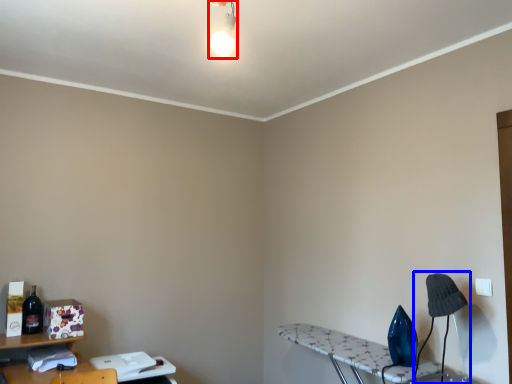
Question: Among these objects, which one is nearest to the camera, light fixture (highlighted by a red box) or table lamp (highlighted by a blue box)?

Choices:
 (A) light fixture
 (B) table lamp

Answer: (A)